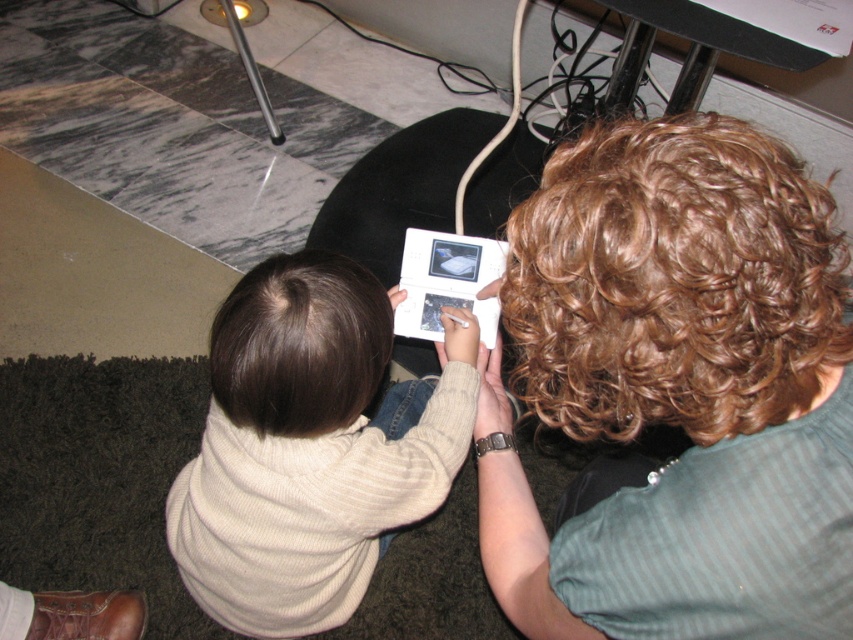
Question: Observing the image, what is the correct spatial positioning of curly brown hair at upper right in reference to white glossy ipod at center?

Choices:
 (A) above
 (B) below

Answer: (B)

Question: Which object is closer to the camera taking this photo?

Choices:
 (A) creamy wool sweater at lower left
 (B) curly brown hair at upper right

Answer: (B)

Question: Can you confirm if curly brown hair at upper right is wider than white glossy ipod at center?

Choices:
 (A) no
 (B) yes

Answer: (B)

Question: Which of the following is the closest to the observer?

Choices:
 (A) curly brown hair at upper right
 (B) white glossy ipod at center

Answer: (A)

Question: Can you confirm if creamy wool sweater at lower left is smaller than white glossy ipod at center?

Choices:
 (A) no
 (B) yes

Answer: (A)

Question: Among these objects, which one is nearest to the camera?

Choices:
 (A) curly brown hair at upper right
 (B) creamy wool sweater at lower left
 (C) white glossy ipod at center

Answer: (A)